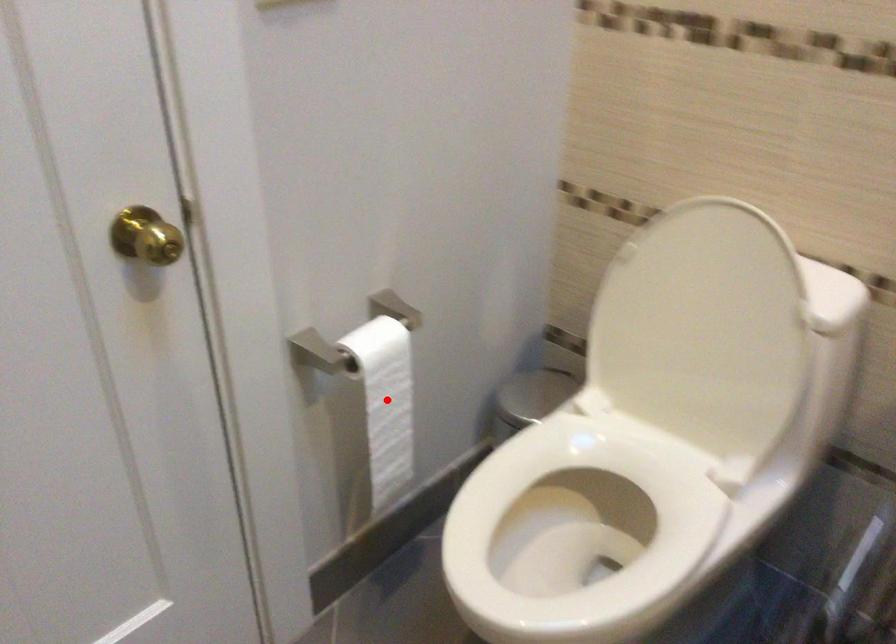
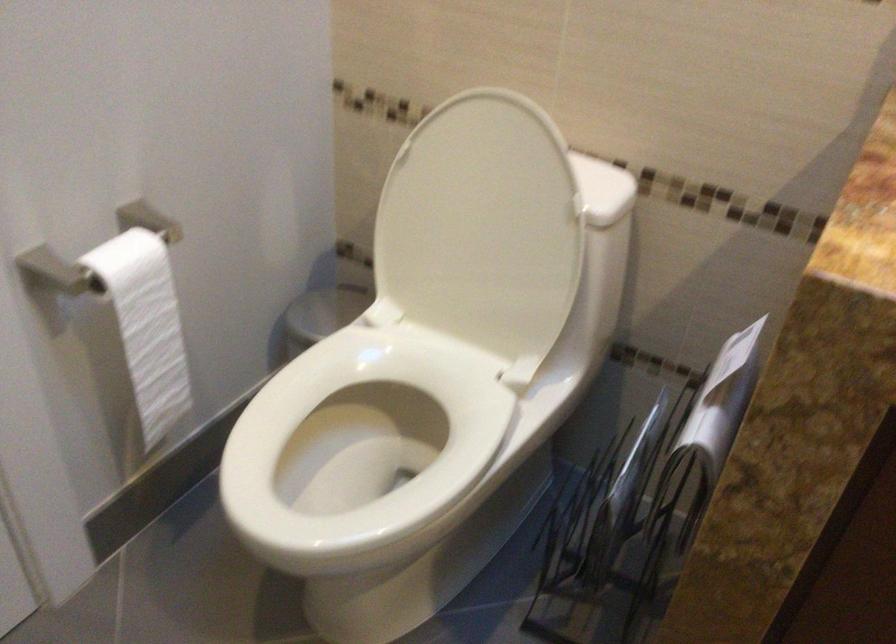
Locate, in the second image, the point that corresponds to the highlighted location in the first image.

(147, 325)